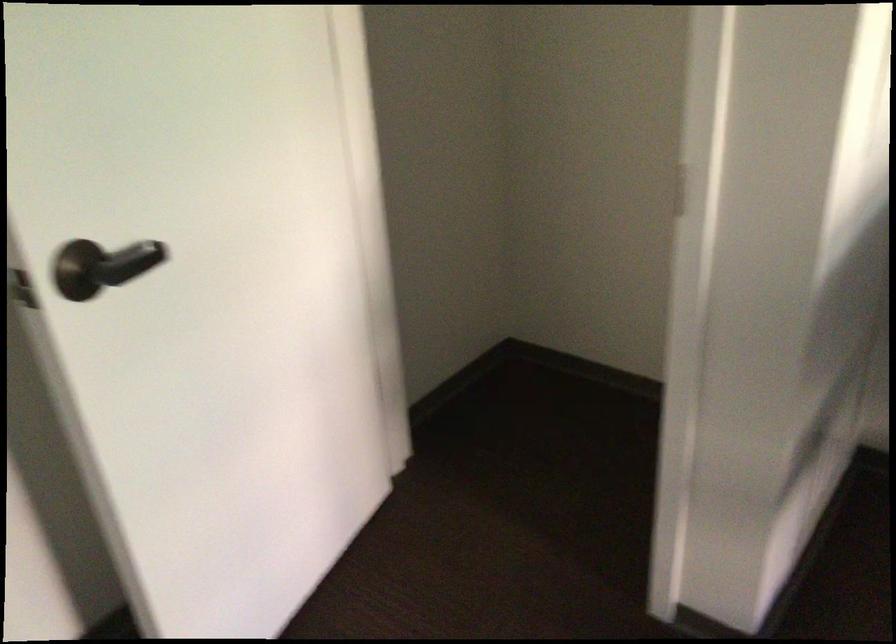
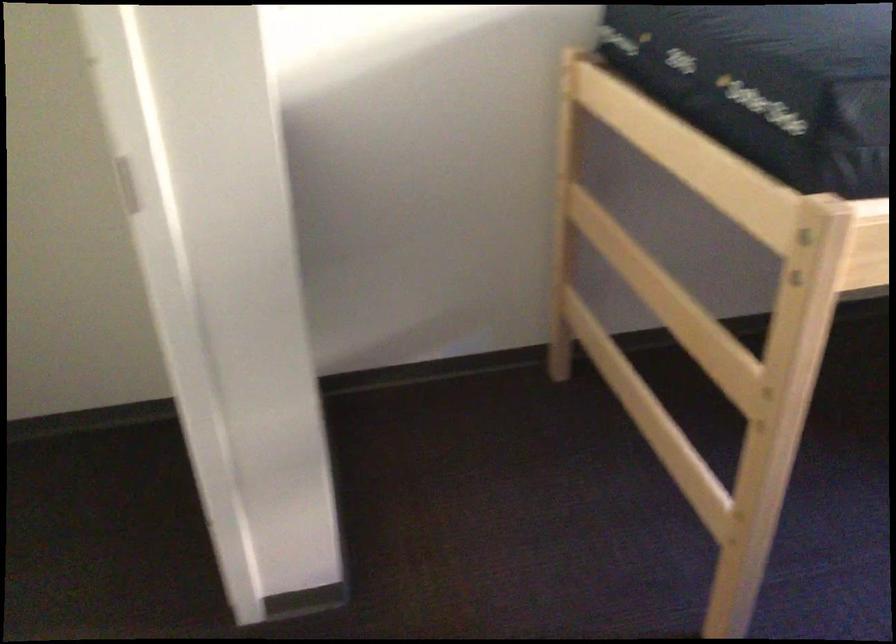
Question: The first image is from the beginning of the video and the second image is from the end. How did the camera likely rotate when shooting the video?

Choices:
 (A) Left
 (B) Right
 (C) Up
 (D) Down

Answer: (B)